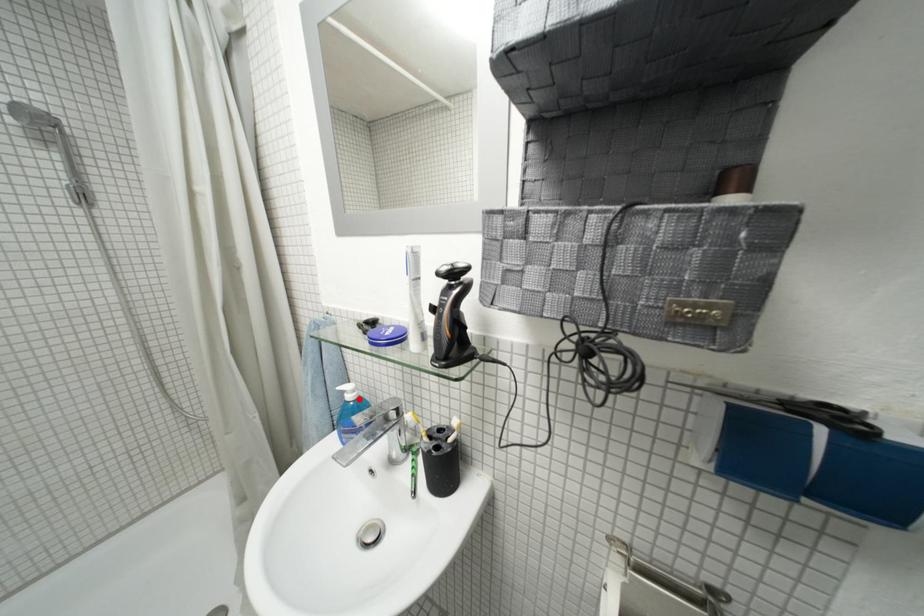
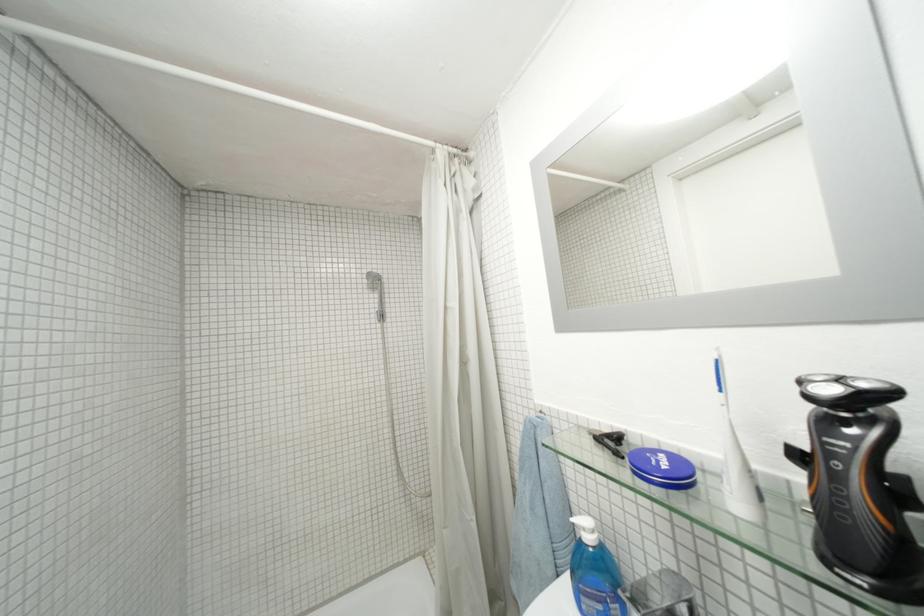
The point at the highlighted location is marked in the first image. Where is the corresponding point in the second image?

(598, 541)